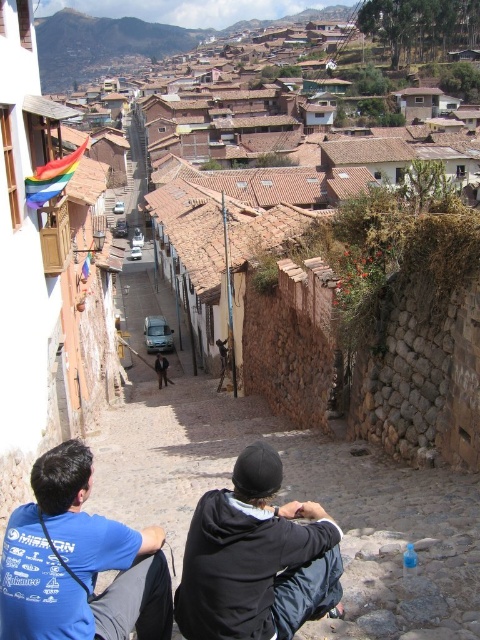
You are a tourist standing at the entrance of this historic street and want to take a photo of both the blue cotton shirt at lower left and the black fleece jacket at center. Which person should you focus on first to ensure both are in clear view?

You should focus on the blue cotton shirt at lower left first since it is closer to you than the black fleece jacket at center, ensuring both are in clear view by focusing on the nearest subject first.